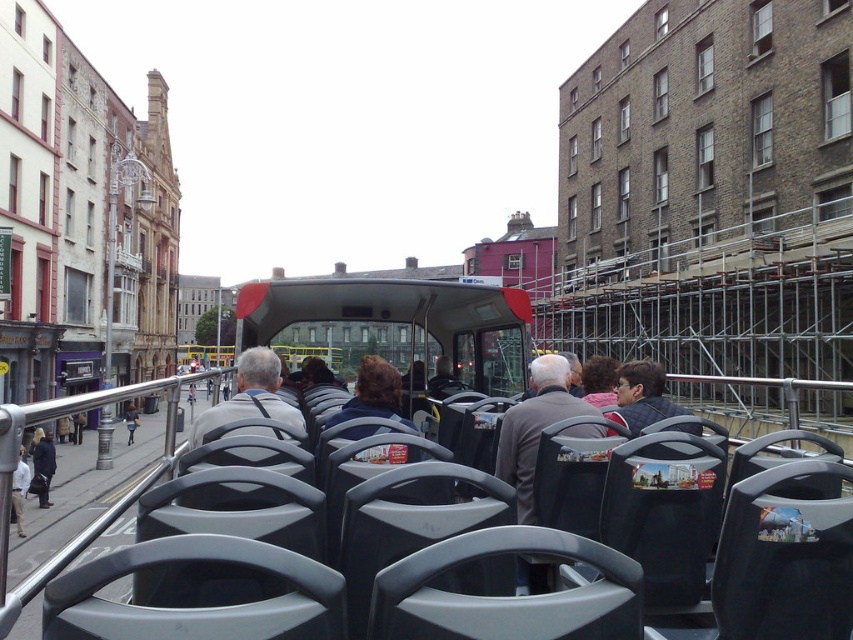
Does gray fabric jacket at center have a greater height compared to dark blue jacket at center?

Yes.

Which is in front, point (218, 426) or point (44, 451)?

Positioned in front is point (218, 426).

Is point (202, 433) farther from camera compared to point (33, 474)?

No, (202, 433) is closer to viewer.

The image size is (853, 640). Find the location of `gray fabric jacket at center`. gray fabric jacket at center is located at coordinates (248, 396).

Who is shorter, matte gray bus at center or gray fabric jacket at center?

gray fabric jacket at center is shorter.

Which of these two, matte gray bus at center or gray fabric jacket at center, stands taller?

matte gray bus at center is taller.

Locate an element on the screen. matte gray bus at center is located at coordinates (395, 321).

Where is `matte gray bus at center`? This screenshot has height=640, width=853. matte gray bus at center is located at coordinates pos(395,321).

Is matte gray bus at center closer to camera compared to dark blue jacket at center?

Yes, matte gray bus at center is closer to the viewer.

How much distance is there between matte gray bus at center and dark blue jacket at center?

matte gray bus at center and dark blue jacket at center are 18.79 meters apart.

The image size is (853, 640). Identify the location of matte gray bus at center. (395, 321).